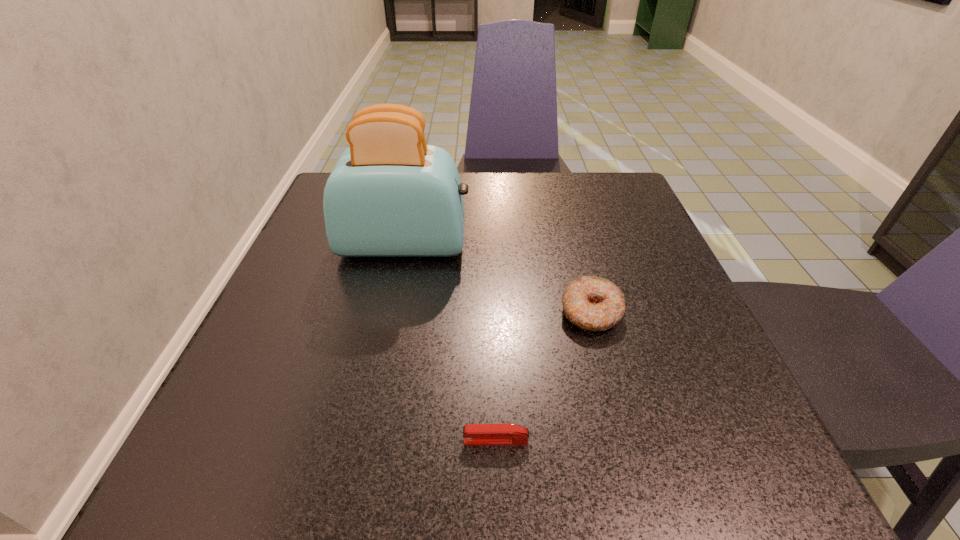
I want to click on vacant point located 0.350m on the front-facing side of the stapler, so click(201, 441).

You are a GUI agent. You are given a task and a screenshot of the screen. Output one action in this format:
    pyautogui.click(x=<x>, y=<y>)
    Task: Click on the object present at the far edge
    This screenshot has height=540, width=960.
    Given the screenshot: What is the action you would take?
    pyautogui.click(x=390, y=194)

Find the location of a particular element. This screenshot has height=540, width=960. object situated at the near edge is located at coordinates tap(474, 434).

The image size is (960, 540). I want to click on object that is positioned at the left edge, so click(x=390, y=194).

In order to click on object that is at the right edge in this screenshot , I will do `click(591, 303)`.

Locate an element on the screen. This screenshot has width=960, height=540. object situated at the far left corner is located at coordinates (390, 194).

In the image, there is a desktop. Find the location of `vacant space at the far edge`. vacant space at the far edge is located at coordinates (542, 174).

I want to click on vacant space at the near edge of the desktop, so click(596, 453).

Image resolution: width=960 pixels, height=540 pixels. What are the coordinates of `free location at the left edge of the desktop` in the screenshot? It's located at (339, 368).

You are a GUI agent. You are given a task and a screenshot of the screen. Output one action in this format:
    pyautogui.click(x=<x>, y=<y>)
    Task: Click on the vacant space at the right edge of the desktop
    This screenshot has width=960, height=540.
    Given the screenshot: What is the action you would take?
    (673, 368)